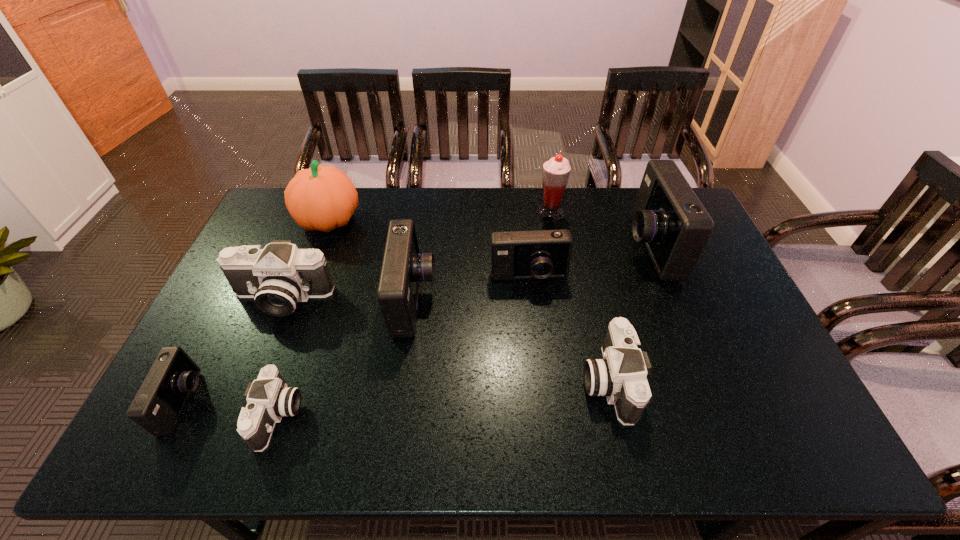
The height and width of the screenshot is (540, 960). I want to click on object at the far right corner, so click(669, 218).

In the image, there is a desktop. Where is `free space at the far edge`? This screenshot has width=960, height=540. free space at the far edge is located at coordinates (456, 213).

Locate an element on the screen. vacant space at the near edge of the desktop is located at coordinates (607, 442).

Where is `vacant region at the right edge`? This screenshot has height=540, width=960. vacant region at the right edge is located at coordinates (721, 308).

This screenshot has width=960, height=540. Find the location of `blank space at the far left corner of the desktop`. blank space at the far left corner of the desktop is located at coordinates (276, 193).

You are a GUI agent. You are given a task and a screenshot of the screen. Output one action in this format:
    pyautogui.click(x=<x>, y=<y>)
    Task: Click on the free space between the third biggest blue camera and the rightmost object
    This screenshot has height=540, width=960.
    Given the screenshot: What is the action you would take?
    pyautogui.click(x=588, y=262)

Find the location of a particular element. free space between the third biggest blue camera and the smallest black camera is located at coordinates (403, 347).

This screenshot has height=540, width=960. I want to click on unoccupied area between the red smoothie and the rightmost black camera, so click(579, 296).

Identify the location of free spot between the nearest blue camera and the farthest black camera. (232, 350).

The image size is (960, 540). Find the location of `vacant area between the smallest blue camera and the smoothie`. vacant area between the smallest blue camera and the smoothie is located at coordinates (368, 308).